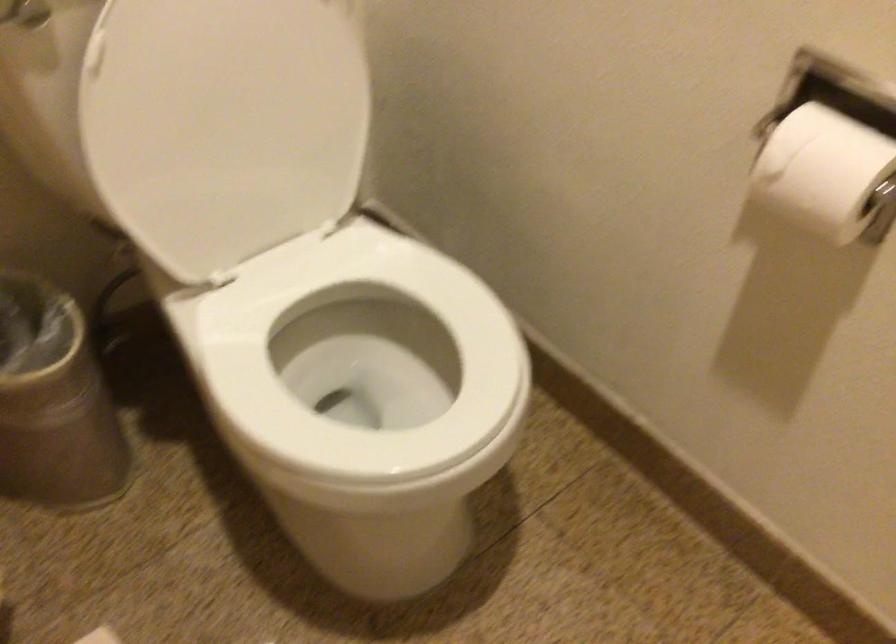
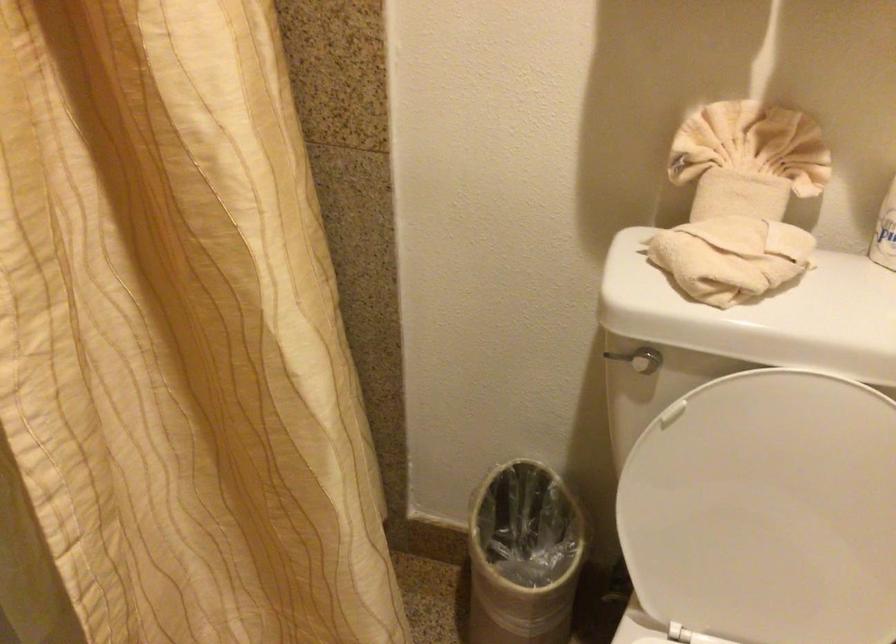
Where in the second image is the point corresponding to (229,115) from the first image?

(767, 511)